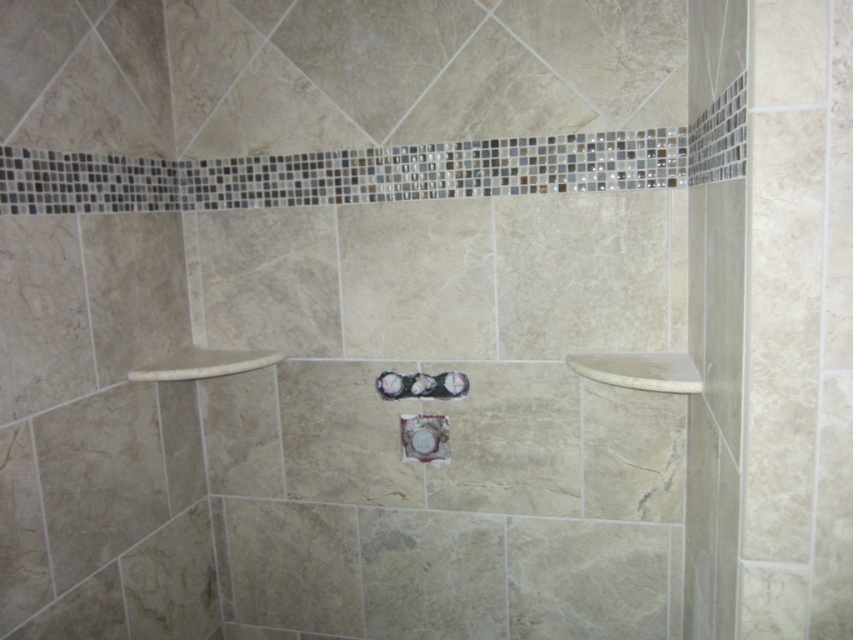
Question: Which point is farther from the camera taking this photo?

Choices:
 (A) (155, 378)
 (B) (421, 380)

Answer: (B)

Question: Is white marble towel bar at upper right thinner than white glossy showerhead at center?

Choices:
 (A) no
 (B) yes

Answer: (A)

Question: Is white marble towel bar at upper right positioned behind white glossy showerhead at center?

Choices:
 (A) no
 (B) yes

Answer: (A)

Question: Which of the following is the closest to the observer?

Choices:
 (A) (677, 381)
 (B) (142, 376)
 (C) (410, 385)

Answer: (A)

Question: Is white marble towel bar at upper right to the left of white glossy showerhead at center from the viewer's perspective?

Choices:
 (A) yes
 (B) no

Answer: (B)

Question: Which point is closer to the camera?

Choices:
 (A) white glossy showerhead at center
 (B) white marble towel bar at upper left
 (C) white marble towel bar at upper right

Answer: (C)